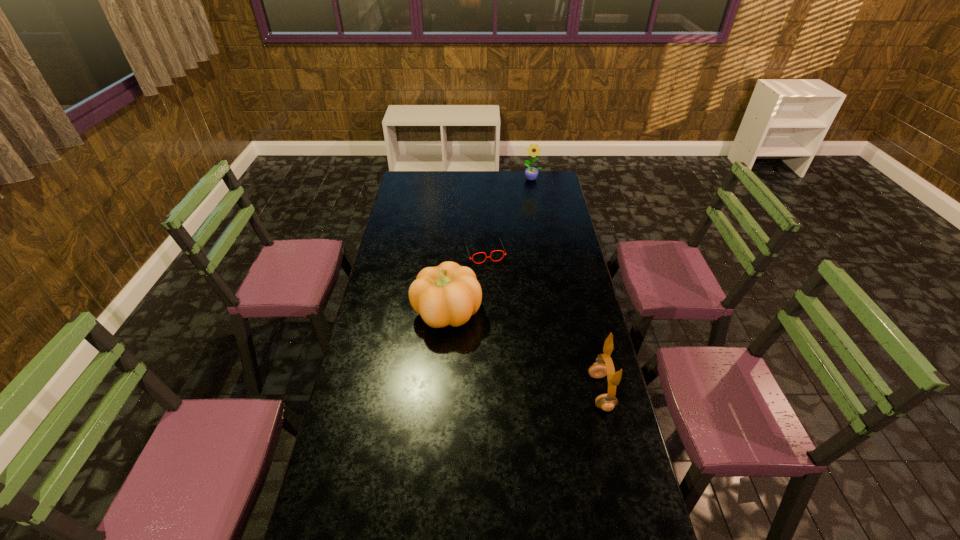
Find the location of `the third farthest object`. the third farthest object is located at coordinates (449, 294).

Where is `the nearest object`? Image resolution: width=960 pixels, height=540 pixels. the nearest object is located at coordinates (606, 402).

At what (x,y) coordinates should I click in order to perform the action: click on earphone. Please return your answer as a coordinate pair (x, y). Image resolution: width=960 pixels, height=540 pixels. Looking at the image, I should click on (606, 402).

This screenshot has height=540, width=960. Find the location of `spectacles`. spectacles is located at coordinates pos(499,238).

Locate an element on the screen. The height and width of the screenshot is (540, 960). the second farthest object is located at coordinates point(499,238).

At what (x,y) coordinates should I click in order to perform the action: click on sunflower. Please return your answer as a coordinate pair (x, y). This screenshot has width=960, height=540. Looking at the image, I should click on (531, 173).

The height and width of the screenshot is (540, 960). I want to click on the farthest object, so click(x=531, y=173).

Image resolution: width=960 pixels, height=540 pixels. Identify the location of free space located on the front of the pumpkin. (443, 364).

Where is `blank area located 0.350m on the front-facing side of the shortest object`? The height and width of the screenshot is (540, 960). blank area located 0.350m on the front-facing side of the shortest object is located at coordinates (508, 321).

Identify the location of free location located 0.060m on the front-facing side of the shortest object. The width and height of the screenshot is (960, 540). (492, 273).